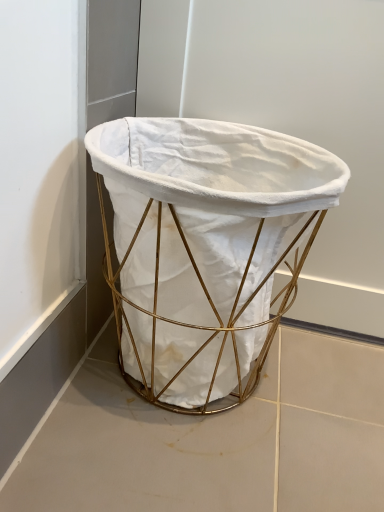
The width and height of the screenshot is (384, 512). What do you see at coordinates (204, 246) in the screenshot?
I see `gold wire mesh basket at center` at bounding box center [204, 246].

The image size is (384, 512). Find the location of `gold wire mesh basket at center`. gold wire mesh basket at center is located at coordinates (204, 246).

The width and height of the screenshot is (384, 512). I want to click on gold wire mesh basket at center, so click(x=204, y=246).